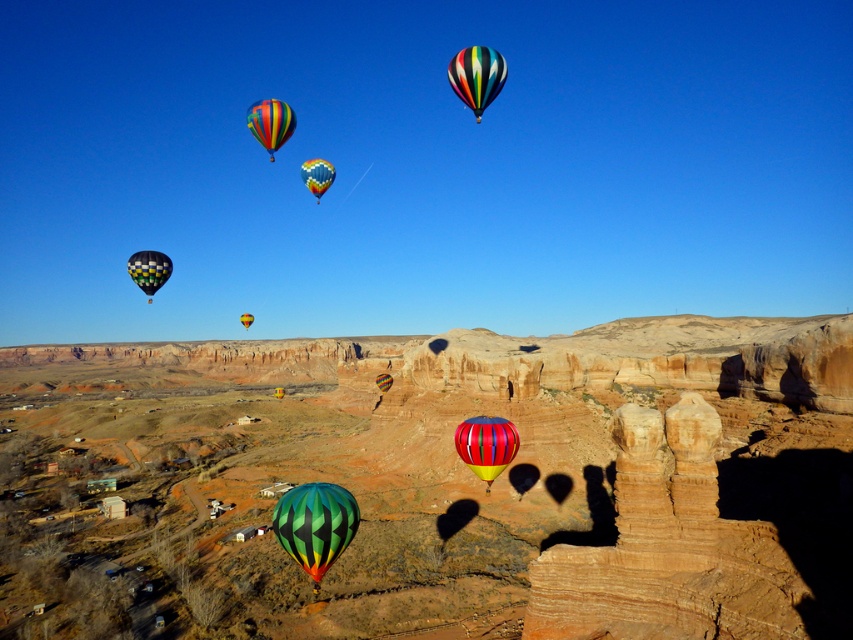
You are standing in the desert looking at the scene. There is a multicolored striped hot air balloon at center. Where is the point at coordinates (317, 176) located in relation to the balloon?

The point at coordinates (317, 176) is located at the center of the multicolored striped hot air balloon.

You are a hot air balloon pilot preparing to land your multicolored striped hot air balloon at center. You need to ensure there is enough space between it and the multicolored fabric hot air balloon at center to avoid collision. The safety distance required is 80 meters. Is the current distance sufficient?

The distance between the multicolored striped hot air balloon at center and the multicolored fabric hot air balloon at center is 76.84 meters, which is less than the required 80 meters safety distance. Therefore, the current distance is not sufficient to avoid collision.

You are standing at the camera position and want to reach the green striped balloon at center. The distance you can walk is limited to 100 feet. Can you reach it?

The green striped balloon at center is 137.00 feet away from camera, so you cannot reach it within the 100 feet limit.